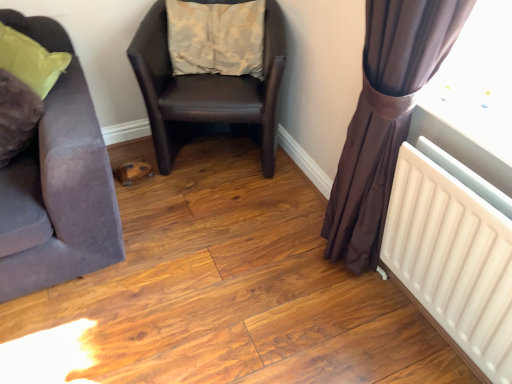
The height and width of the screenshot is (384, 512). In order to click on vacant region to the left of brown sheer curtain at right in this screenshot , I will do `click(254, 297)`.